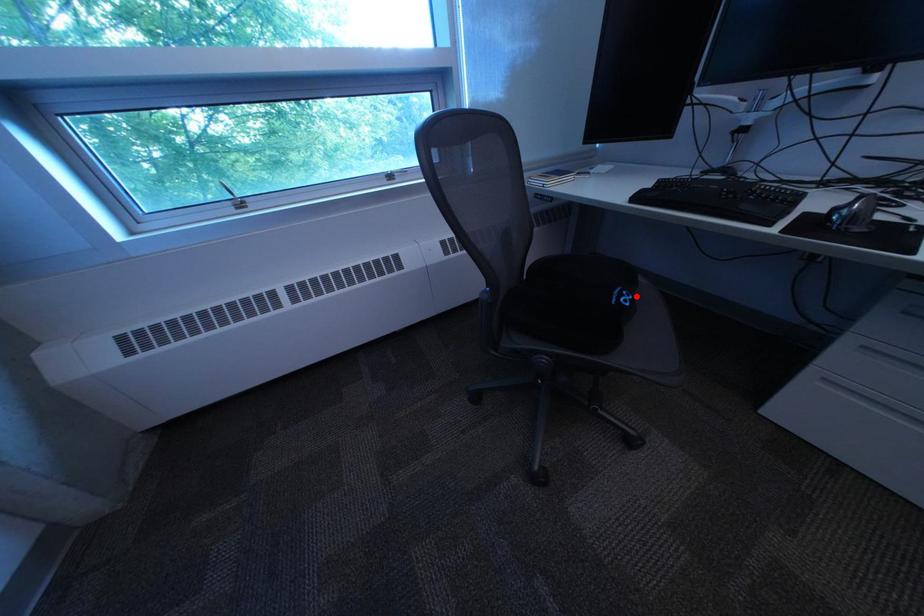
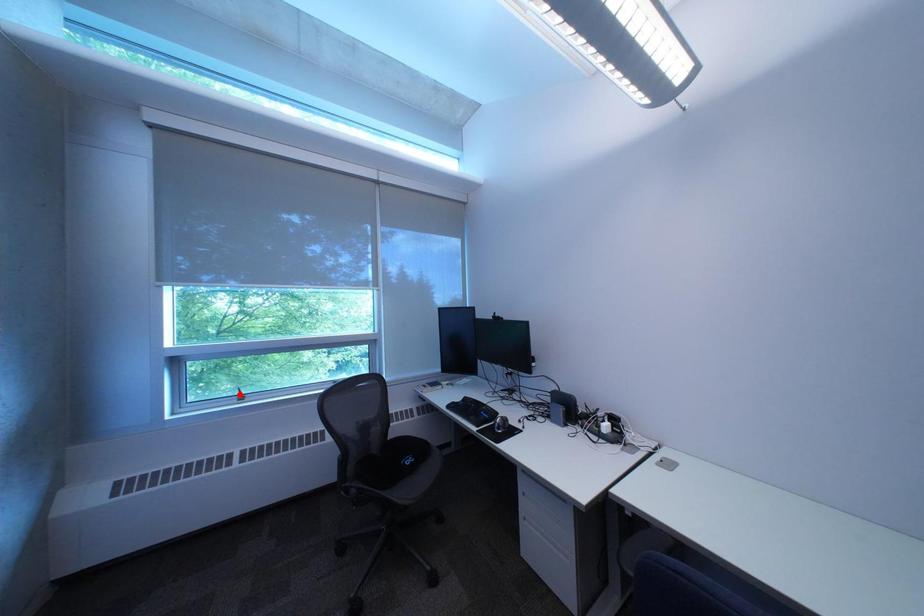
I am providing you with two images of the same scene from different viewpoints. A red point is marked on the first image and another point is marked on the second image. Is the red point in image1 aligned with the point shown in image2?

No